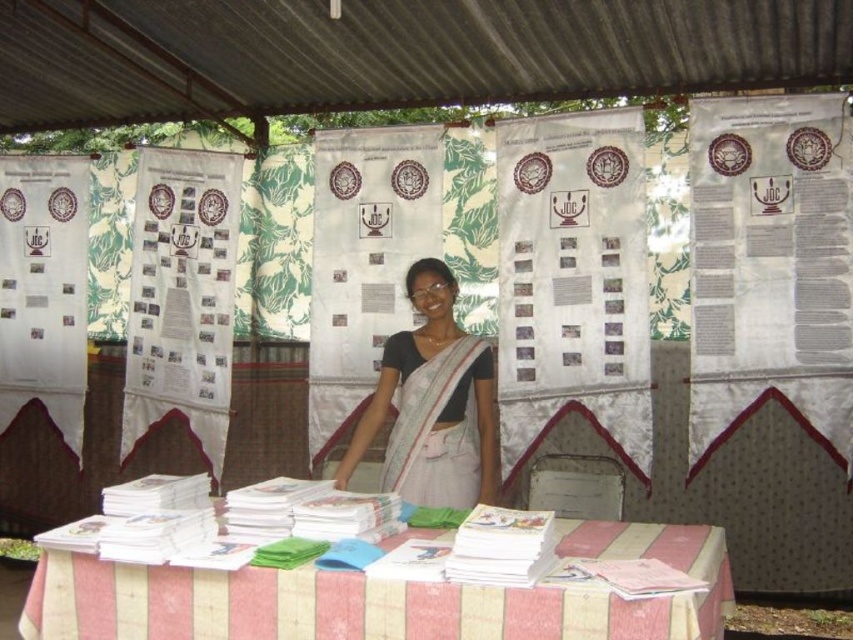
Question: Does white striped fabric at lower center appear over white silk saree at center?

Choices:
 (A) no
 (B) yes

Answer: (A)

Question: Which of the following is the closest to the observer?

Choices:
 (A) (71, 632)
 (B) (434, 428)

Answer: (A)

Question: Which point is closer to the camera taking this photo?

Choices:
 (A) (413, 280)
 (B) (679, 596)
 (C) (454, 477)

Answer: (B)

Question: Estimate the real-world distances between objects in this image. Which object is farther from the white silk saree at center?

Choices:
 (A) white striped fabric at lower center
 (B) white cotton sari at center

Answer: (A)

Question: Is white striped fabric at lower center bigger than white cotton sari at center?

Choices:
 (A) yes
 (B) no

Answer: (A)

Question: Is the position of white striped fabric at lower center more distant than that of white silk saree at center?

Choices:
 (A) yes
 (B) no

Answer: (B)